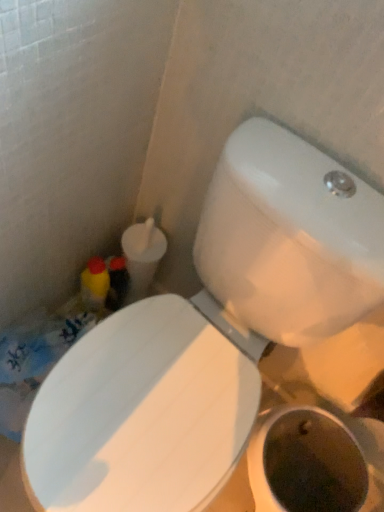
In order to face white glossy toilet at center, should I rotate leftwards or rightwards?

Rotate your view left by about 2.706°.

This screenshot has width=384, height=512. Find the location of `white glossy toilet at center`. white glossy toilet at center is located at coordinates (213, 324).

This screenshot has height=512, width=384. What do you see at coordinates (213, 324) in the screenshot?
I see `white glossy toilet at center` at bounding box center [213, 324].

Identify the location of white glossy toilet at center. The width and height of the screenshot is (384, 512). (213, 324).